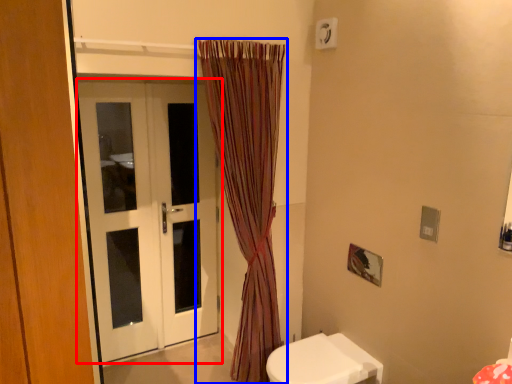
Question: Which point is further to the camera, door (highlighted by a red box) or curtain (highlighted by a blue box)?

Choices:
 (A) door
 (B) curtain

Answer: (A)